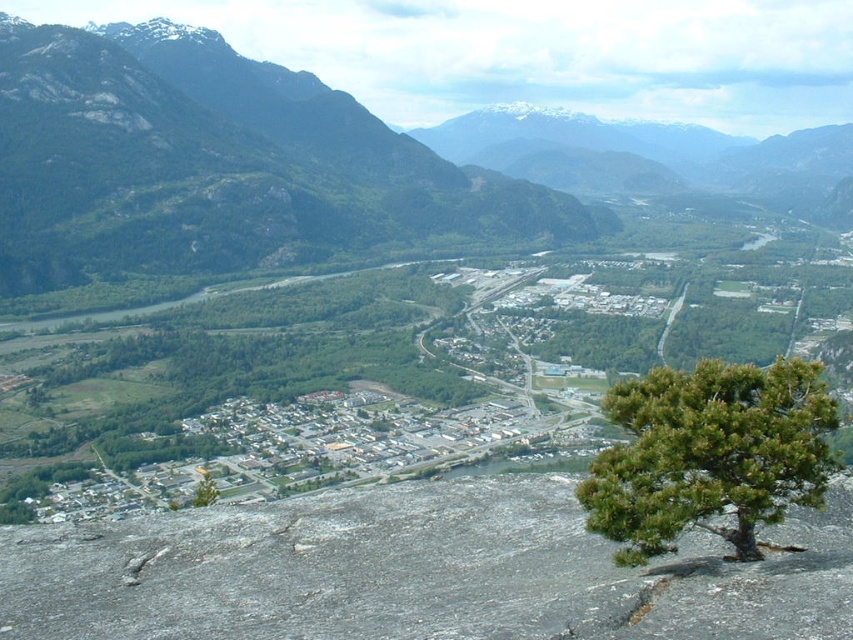
Is point (606, 486) in front of point (209, 502)?

Yes.

Which of these two, green textured tree at lower right or green matte tree at lower left, stands taller?

Standing taller between the two is green matte tree at lower left.

This screenshot has height=640, width=853. In order to click on green textured tree at lower right in this screenshot , I will do (709, 454).

Locate an element on the screen. The width and height of the screenshot is (853, 640). green textured tree at lower right is located at coordinates (709, 454).